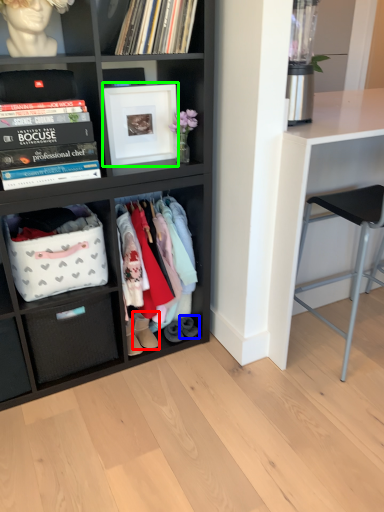
Question: Considering the real-world distances, which object is closest to footwear (highlighted by a red box)? footwear (highlighted by a blue box) or picture frame (highlighted by a green box).

Choices:
 (A) footwear
 (B) picture frame

Answer: (A)